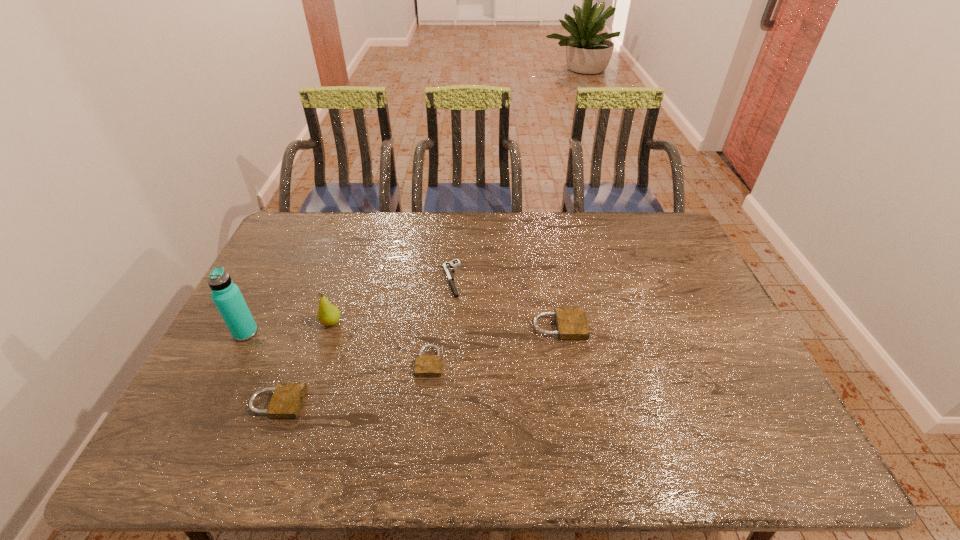
Locate an element on the screen. unoccupied position between the second tallest object and the second tallest padlock is located at coordinates (304, 363).

Image resolution: width=960 pixels, height=540 pixels. What are the coordinates of `empty space that is in between the farthest object and the fourth shortest object` in the screenshot? It's located at (505, 303).

Locate an element on the screen. This screenshot has height=540, width=960. empty space between the leftmost object and the shortest object is located at coordinates (348, 306).

Find the location of `empty space between the rightmost object and the fifth shortest object`. empty space between the rightmost object and the fifth shortest object is located at coordinates (445, 325).

This screenshot has height=540, width=960. Identify the location of free space that is in between the shortest object and the leftmost object. (348, 306).

Where is `empty space between the nearest padlock and the farthest object`? empty space between the nearest padlock and the farthest object is located at coordinates (364, 341).

You are a GUI agent. You are given a task and a screenshot of the screen. Output one action in this format:
    pyautogui.click(x=<x>, y=<y>)
    Task: Click on the vacant point located between the nearest object and the leftmost object
    
    Given the screenshot: What is the action you would take?
    [x=261, y=368]

Find the location of a particular element. Image resolution: width=960 pixels, height=540 pixels. vacant space in between the second nearest object and the water bottle is located at coordinates (338, 347).

Image resolution: width=960 pixels, height=540 pixels. Find the location of `free spot between the nearest padlock and the tallest object`. free spot between the nearest padlock and the tallest object is located at coordinates (261, 368).

Locate an element on the screen. The width and height of the screenshot is (960, 540). object that stands as the fourth closest to the pear is located at coordinates click(x=448, y=266).